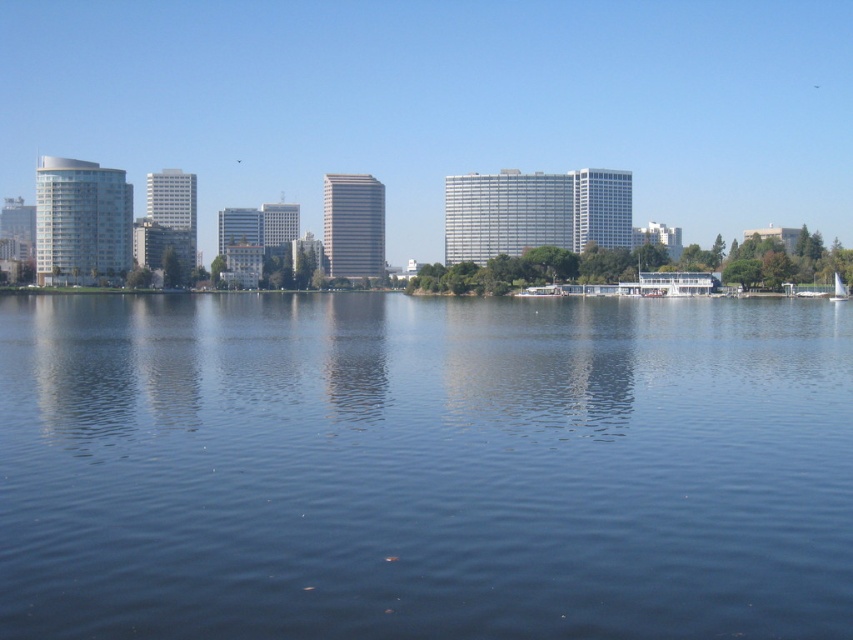
Does blue liquid water at center appear on the right side of white sailboat at center?

In fact, blue liquid water at center is to the left of white sailboat at center.

In the scene shown: Between blue liquid water at center and white sailboat at center, which one is positioned higher?

white sailboat at center is higher up.

Is point (824, 616) positioned in front of point (843, 285)?

Yes, point (824, 616) is closer to viewer.

Where is `blue liquid water at center`? Image resolution: width=853 pixels, height=640 pixels. blue liquid water at center is located at coordinates (424, 467).